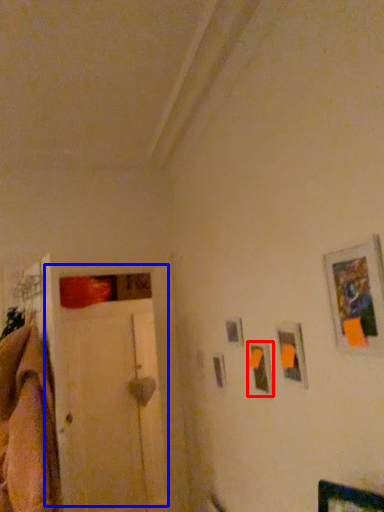
Question: Which object is closer to the camera taking this photo, picture frame (highlighted by a red box) or door (highlighted by a blue box)?

Choices:
 (A) picture frame
 (B) door

Answer: (A)